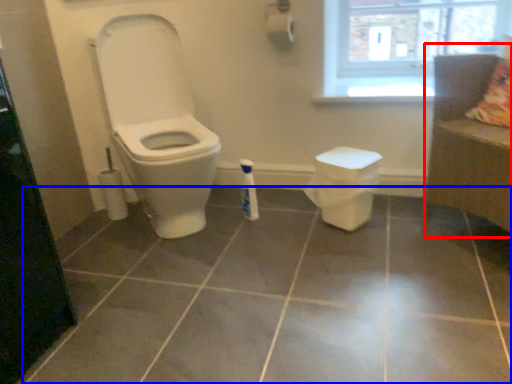
Question: Which object appears closest to the camera in this image, couch (highlighted by a red box) or ceramic tile (highlighted by a blue box)?

Choices:
 (A) couch
 (B) ceramic tile

Answer: (B)